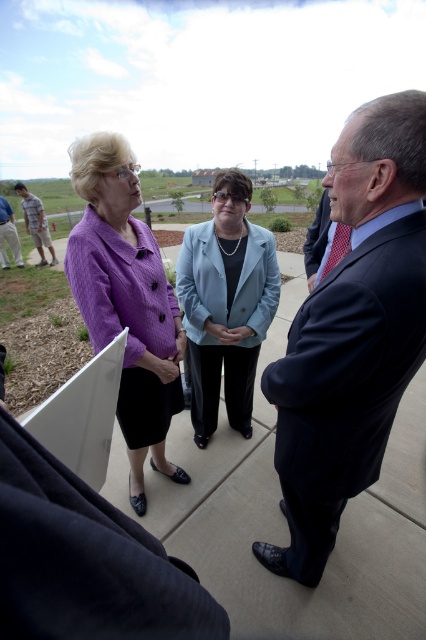
Is point (212, 417) positioned after point (3, 268)?

No, (212, 417) is in front of (3, 268).

Who is higher up, light blue fabric jacket at center or khaki cotton pants at lower left?

Positioned higher is khaki cotton pants at lower left.

Measure the distance between point [230,294] and camera.

Point [230,294] and camera are 8.62 feet apart from each other.

This screenshot has width=426, height=640. I want to click on light blue fabric jacket at center, so click(226, 305).

Is striped cotton shirt at left wider than khaki cotton pants at lower left?

Yes.

How distant is striped cotton shirt at left from khaki cotton pants at lower left?

They are 74.88 centimeters apart.

Image resolution: width=426 pixels, height=640 pixels. What do you see at coordinates (36, 224) in the screenshot?
I see `striped cotton shirt at left` at bounding box center [36, 224].

Image resolution: width=426 pixels, height=640 pixels. What are the coordinates of `striped cotton shirt at left` in the screenshot? It's located at (36, 224).

Which is below, purple textured sweater at center or khaki cotton pants at lower left?

purple textured sweater at center is below.

Who is more forward, (x=143, y=481) or (x=20, y=257)?

Point (x=143, y=481) is in front.

Between point (118, 310) and point (2, 264), which one is positioned in front?

Point (118, 310) is in front.

Image resolution: width=426 pixels, height=640 pixels. What are the coordinates of `purple textured sweater at center` in the screenshot? It's located at (126, 301).